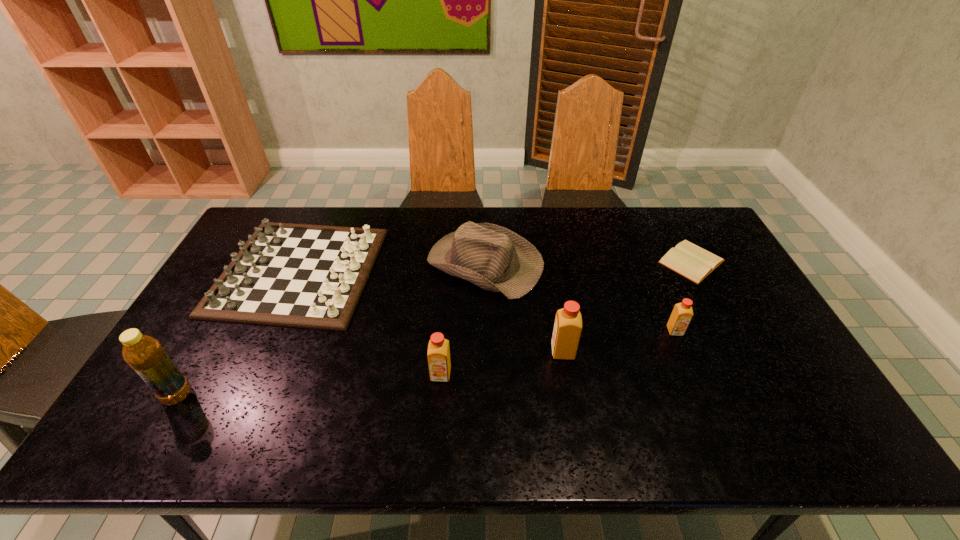
Locate an element on the screen. The height and width of the screenshot is (540, 960). chessboard that is at the far edge is located at coordinates (294, 275).

Locate an element on the screen. This screenshot has height=540, width=960. fedora located at the far edge is located at coordinates (496, 259).

This screenshot has height=540, width=960. What are the coordinates of `diary at the far edge` in the screenshot? It's located at (689, 260).

The height and width of the screenshot is (540, 960). Find the location of `orange juice at the near edge`. orange juice at the near edge is located at coordinates (438, 349).

I want to click on bottle positioned at the near edge, so click(x=143, y=353).

The height and width of the screenshot is (540, 960). I want to click on chessboard at the left edge, so click(x=294, y=275).

You are a GUI agent. You are given a task and a screenshot of the screen. Output one action in this format:
    pyautogui.click(x=<x>, y=<y>)
    Task: Click on the bottle present at the left edge
    This screenshot has width=960, height=540.
    Given the screenshot: What is the action you would take?
    pyautogui.click(x=143, y=353)

This screenshot has width=960, height=540. In order to click on object at the right edge in this screenshot , I will do `click(689, 260)`.

Identify the location of object at the far left corner. (294, 275).

Locate an element on the screen. This screenshot has width=960, height=540. object located at the near left corner is located at coordinates (143, 353).